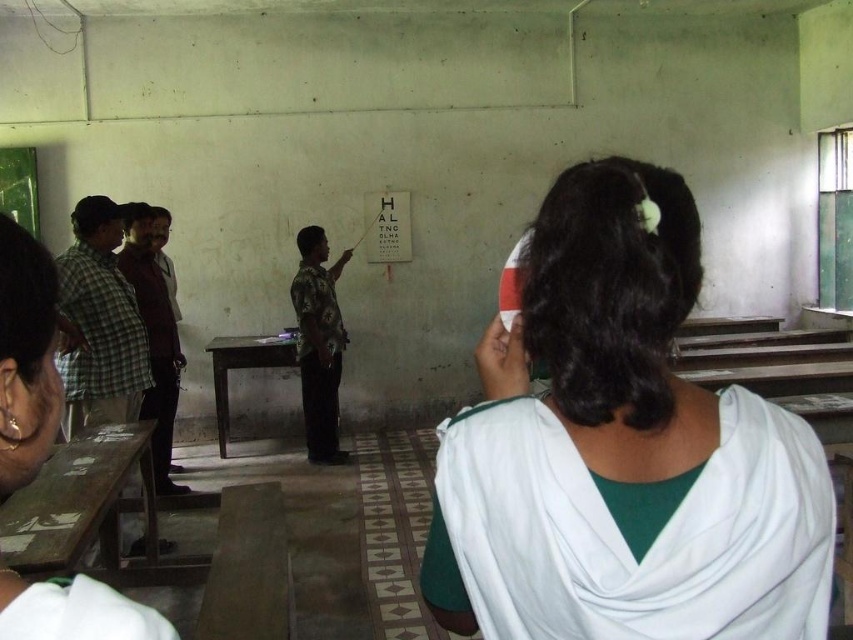
You are standing in the classroom and want to find the green plaid shirt at left. According to the scene description, where should you look?

The green plaid shirt at left is located at the 2D coordinates point (99, 323) in the image.

You are standing in the classroom and need to hand out a form to both the green plaid shirt at left and the camouflage shirt at center. Which person should you approach first to ensure you can reach them without moving past the other?

You should approach the green plaid shirt at left first because it is closer to the viewer than the camouflage shirt at center, so you can reach them without needing to move past the other person.

You are a photographer setting up for a group photo in the classroom. You notice the white fabric headband at upper center and the green plaid shirt at left. Which object should you adjust to ensure both are fully visible in the frame?

The white fabric headband at upper center is in front of the green plaid shirt at left, so you should adjust the green plaid shirt at left to move it out of the way so both can be seen.